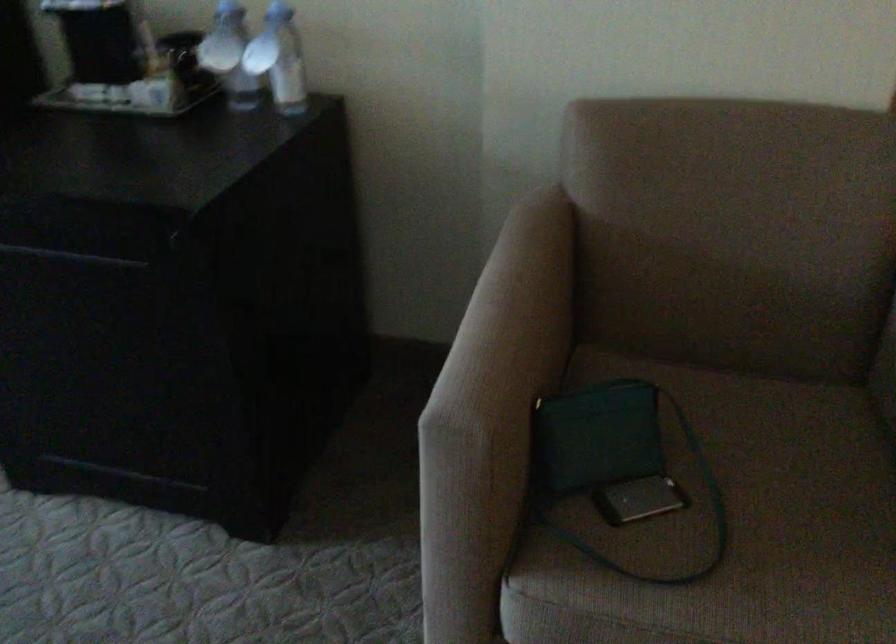
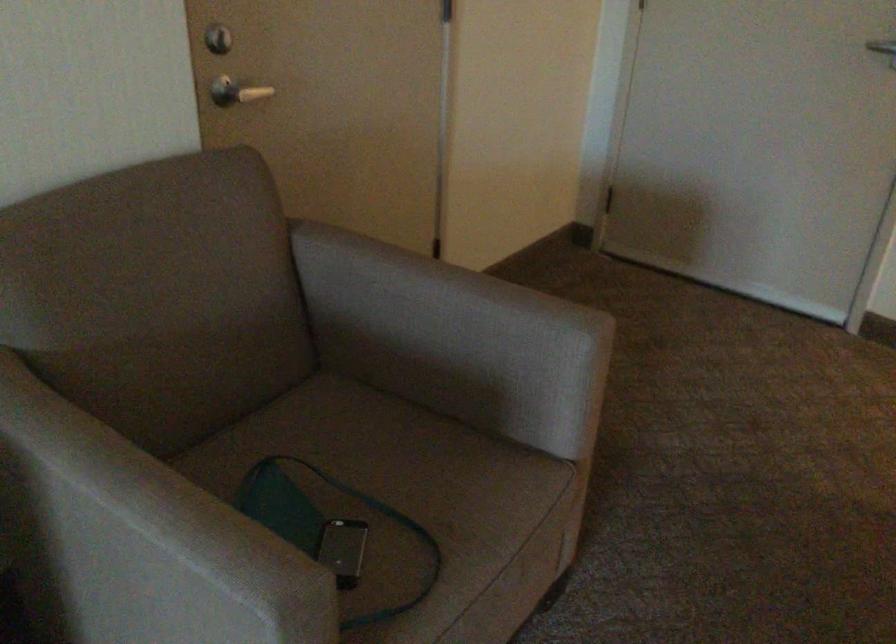
Question: How did the camera likely rotate?

Choices:
 (A) Left
 (B) Right
 (C) Up
 (D) Down

Answer: (B)